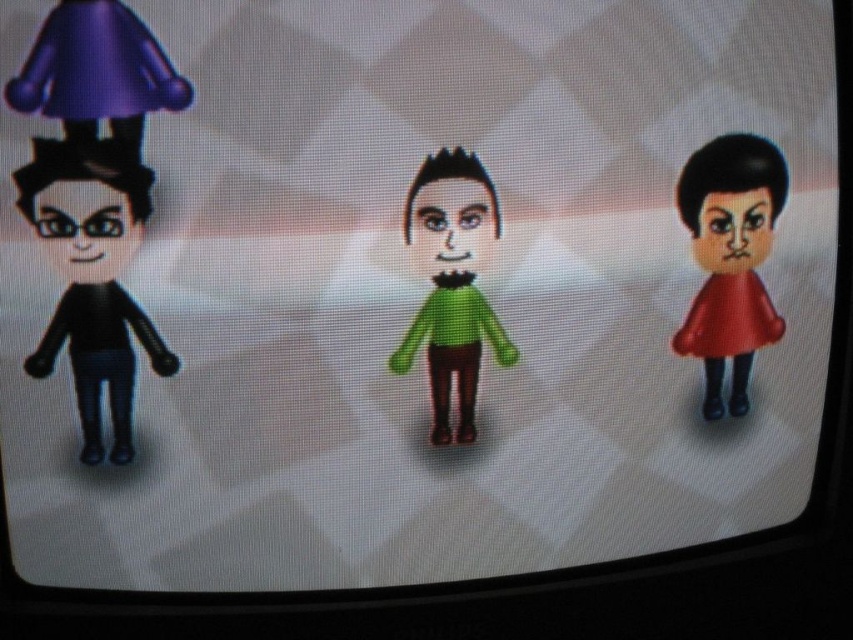
Does matte black figure at left have a greater height compared to green matte sweater at center?

Correct, matte black figure at left is much taller as green matte sweater at center.

Does matte black figure at left lie behind green matte sweater at center?

No, matte black figure at left is closer to the viewer.

Does point (106, 356) come in front of point (422, 172)?

No.

Identify the location of matte black figure at left. The height and width of the screenshot is (640, 853). (91, 276).

This screenshot has width=853, height=640. What do you see at coordinates (91, 276) in the screenshot? I see `matte black figure at left` at bounding box center [91, 276].

Is the position of matte black figure at left less distant than that of purple glossy umbrella at upper left?

No.

This screenshot has height=640, width=853. Identify the location of matte black figure at left. (91, 276).

Is green matte sweater at center closer to camera compared to matte black face at left?

That is False.

Is green matte sweater at center above matte black face at left?

Actually, green matte sweater at center is below matte black face at left.

The height and width of the screenshot is (640, 853). What do you see at coordinates (451, 284) in the screenshot?
I see `green matte sweater at center` at bounding box center [451, 284].

Where is `green matte sweater at center`? This screenshot has height=640, width=853. green matte sweater at center is located at coordinates (451, 284).